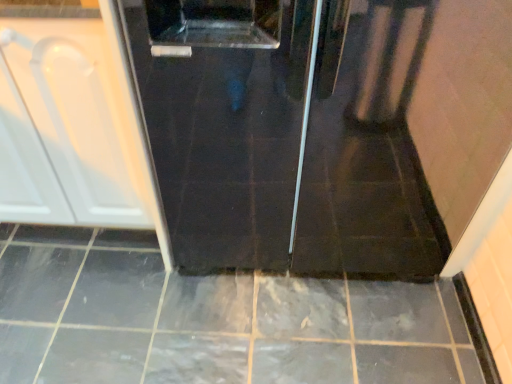
Question: From a real-world perspective, is white glossy cabinet at left above or below glossy ceramic tile at center?

Choices:
 (A) below
 (B) above

Answer: (B)

Question: From the image's perspective, relative to glossy ceramic tile at center, is white glossy cabinet at left above or below?

Choices:
 (A) above
 (B) below

Answer: (A)

Question: Is white glossy cabinet at left taller or shorter than glossy ceramic tile at center?

Choices:
 (A) tall
 (B) short

Answer: (A)

Question: Is glossy ceramic tile at center wider or thinner than white glossy cabinet at left?

Choices:
 (A) wide
 (B) thin

Answer: (A)

Question: Considering the relative positions of glossy ceramic tile at center and white glossy cabinet at left in the image provided, is glossy ceramic tile at center to the left or to the right of white glossy cabinet at left?

Choices:
 (A) left
 (B) right

Answer: (B)

Question: From a real-world perspective, is glossy ceramic tile at center physically located above or below white glossy cabinet at left?

Choices:
 (A) below
 (B) above

Answer: (A)

Question: Based on their sizes in the image, would you say glossy ceramic tile at center is bigger or smaller than white glossy cabinet at left?

Choices:
 (A) small
 (B) big

Answer: (A)